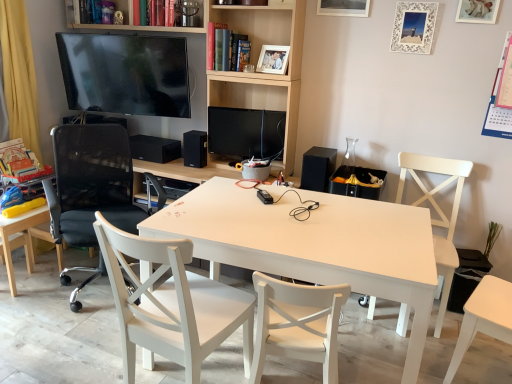
I want to click on free spot to the left of white wood chair at center, the 3th chair viewed from the left, so click(88, 354).